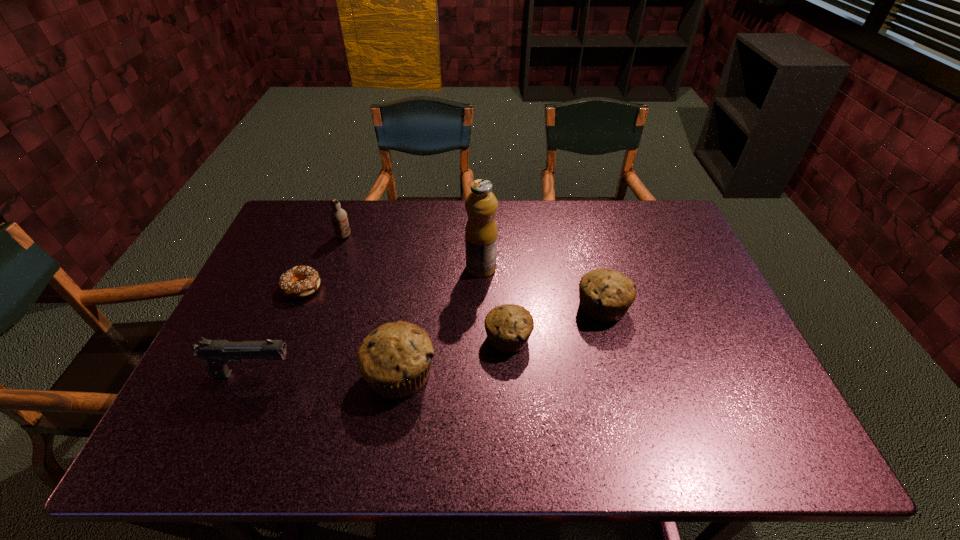
Where is `free space located on the left of the shortest muffin`? free space located on the left of the shortest muffin is located at coordinates (372, 338).

Where is `vacant region located on the back of the rightmost muffin`? This screenshot has height=540, width=960. vacant region located on the back of the rightmost muffin is located at coordinates (586, 245).

Image resolution: width=960 pixels, height=540 pixels. What are the coordinates of `free location located 0.280m on the front label of the fruit juice` in the screenshot? It's located at (372, 268).

This screenshot has height=540, width=960. I want to click on vacant space located on the front label of the fruit juice, so click(x=413, y=268).

Where is `free space located on the front label of the fruit juice`? This screenshot has height=540, width=960. free space located on the front label of the fruit juice is located at coordinates (356, 268).

Locate an element on the screen. vacant region located 0.080m on the right of the chocolate milk is located at coordinates (376, 236).

Locate an element on the screen. free space located in the direction the gun is aimed is located at coordinates click(x=330, y=374).

The height and width of the screenshot is (540, 960). Find the location of `free space located 0.300m on the back of the doughnut`. free space located 0.300m on the back of the doughnut is located at coordinates (331, 214).

Where is `object located in the far edge section of the desktop`? This screenshot has height=540, width=960. object located in the far edge section of the desktop is located at coordinates (338, 216).

Identify the location of muffin that is at the near edge. (395, 359).